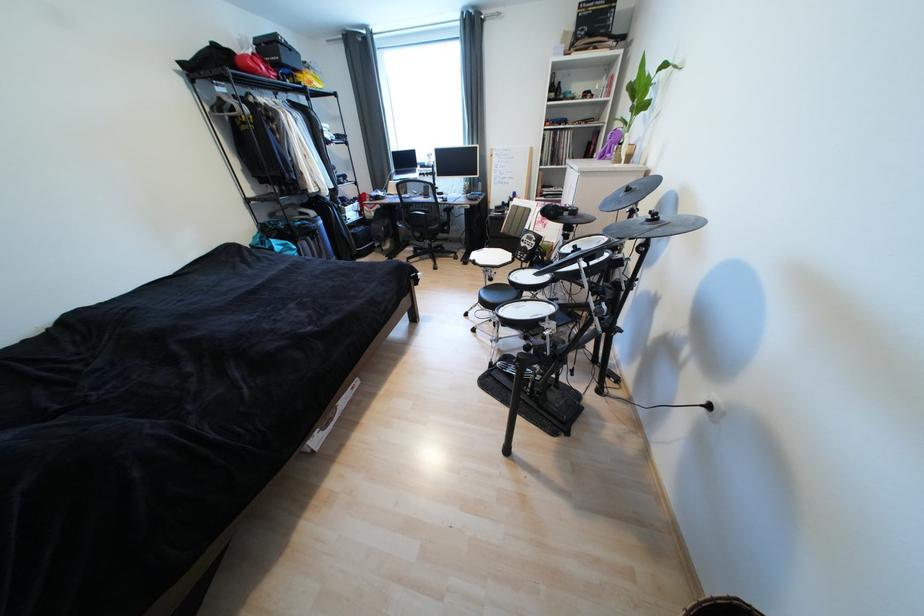
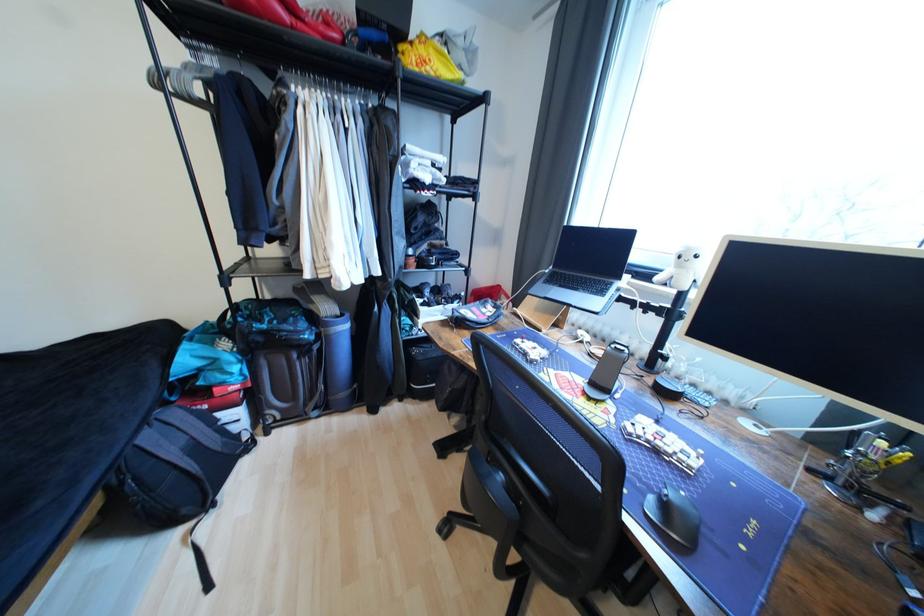
The point at (305, 77) is marked in the first image. Where is the corresponding point in the second image?

(407, 49)